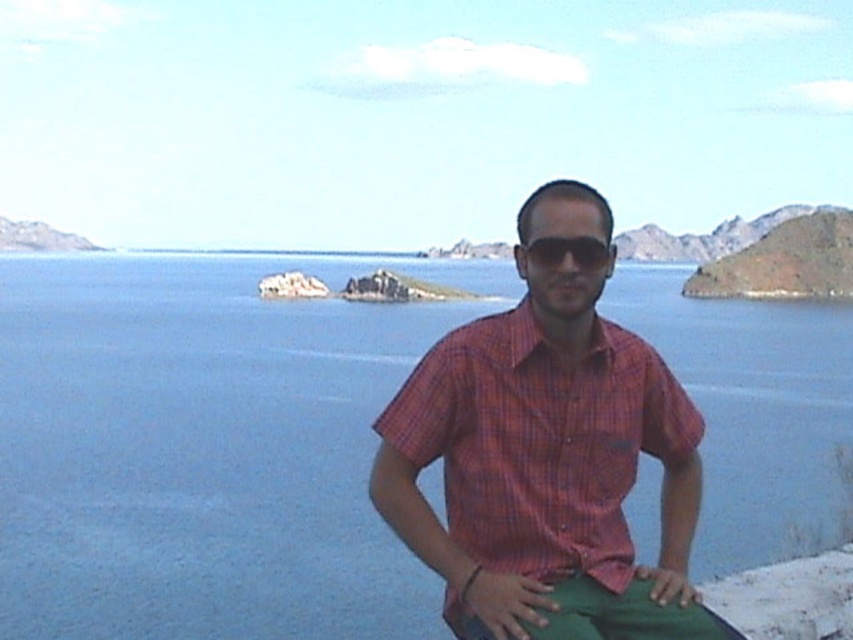
Is blue water at center below black matte sunglasses at center?

No.

Is blue water at center smaller than black matte sunglasses at center?

No.

Is point (746, 397) positioned after point (598, 243)?

Yes, point (746, 397) is farther from viewer.

Identify the location of blue water at center. (206, 449).

Which is below, plaid cotton shirt at center or black matte sunglasses at center?

plaid cotton shirt at center is below.

Where is `plaid cotton shirt at center`? plaid cotton shirt at center is located at coordinates (546, 456).

This screenshot has height=640, width=853. I want to click on plaid cotton shirt at center, so click(x=546, y=456).

Can you confirm if blue water at center is positioned below plaid cotton shirt at center?

Incorrect, blue water at center is not positioned below plaid cotton shirt at center.

Which is behind, point (802, 301) or point (675, 483)?

Positioned behind is point (802, 301).

Where is `blue water at center`? blue water at center is located at coordinates (206, 449).